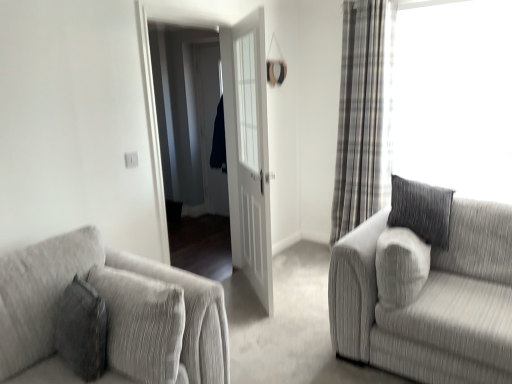
Question: Would you say white glossy door at center contains textured gray couch at right, placed as the 2th studio couch when sorted from left to right?

Choices:
 (A) no
 (B) yes

Answer: (A)

Question: Considering the relative sizes of white glossy door at center and textured gray couch at right, placed as the 2th studio couch when sorted from left to right, in the image provided, is white glossy door at center shorter than textured gray couch at right, placed as the 2th studio couch when sorted from left to right,?

Choices:
 (A) no
 (B) yes

Answer: (A)

Question: Considering the relative sizes of white glossy door at center and textured gray couch at right, the 1th studio couch viewed from the right, in the image provided, is white glossy door at center bigger than textured gray couch at right, the 1th studio couch viewed from the right,?

Choices:
 (A) no
 (B) yes

Answer: (A)

Question: Is the position of white glossy door at center more distant than that of textured gray couch at right, the 1th studio couch viewed from the right?

Choices:
 (A) yes
 (B) no

Answer: (A)

Question: From a real-world perspective, does white glossy door at center stand above textured gray couch at right, the 1th studio couch viewed from the right?

Choices:
 (A) no
 (B) yes

Answer: (B)

Question: Can you confirm if white glossy door at center is positioned to the left of textured gray couch at right, placed as the 2th studio couch when sorted from left to right?

Choices:
 (A) yes
 (B) no

Answer: (A)

Question: Would you say white glossy door at center is part of textured gray couch at lower left, the 2th studio couch in the right-to-left sequence,'s contents?

Choices:
 (A) no
 (B) yes

Answer: (A)

Question: Is textured gray couch at lower left, the 2th studio couch in the right-to-left sequence, oriented away from white glossy door at center?

Choices:
 (A) no
 (B) yes

Answer: (A)

Question: Considering the relative sizes of textured gray couch at lower left, which ranks as the first studio couch in left-to-right order, and white glossy door at center in the image provided, is textured gray couch at lower left, which ranks as the first studio couch in left-to-right order, wider than white glossy door at center?

Choices:
 (A) yes
 (B) no

Answer: (A)

Question: Does textured gray couch at lower left, the 2th studio couch in the right-to-left sequence, turn towards white glossy door at center?

Choices:
 (A) no
 (B) yes

Answer: (A)

Question: Is textured gray couch at lower left, which ranks as the first studio couch in left-to-right order, outside of white glossy door at center?

Choices:
 (A) no
 (B) yes

Answer: (B)

Question: Can you confirm if textured gray couch at lower left, which ranks as the first studio couch in left-to-right order, is positioned to the right of white glossy door at center?

Choices:
 (A) yes
 (B) no

Answer: (B)

Question: From a real-world perspective, does plaid fabric curtain at right sit lower than textured gray couch at right, placed as the 2th studio couch when sorted from left to right?

Choices:
 (A) no
 (B) yes

Answer: (A)